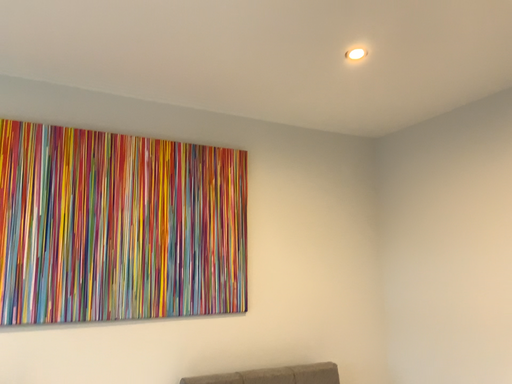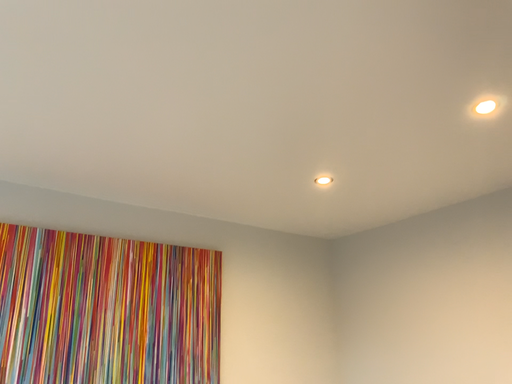
Question: How did the camera likely rotate when shooting the video?

Choices:
 (A) rotated left
 (B) rotated right

Answer: (B)